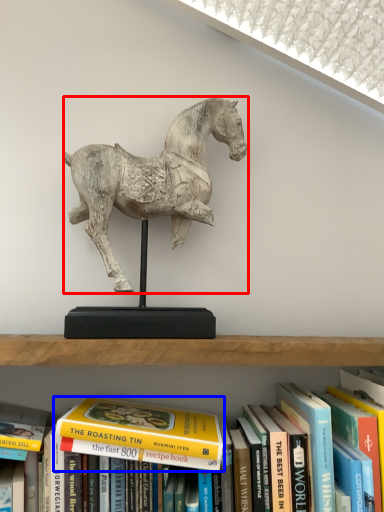
Question: Which object appears closest to the camera in this image, horse (highlighted by a red box) or book (highlighted by a blue box)?

Choices:
 (A) horse
 (B) book

Answer: (B)